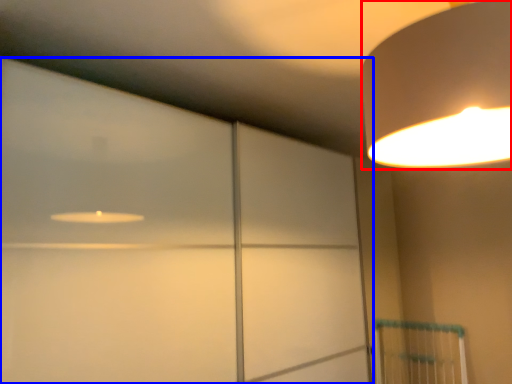
Question: Among these objects, which one is farthest to the camera, lamp (highlighted by a red box) or glass door (highlighted by a blue box)?

Choices:
 (A) lamp
 (B) glass door

Answer: (B)